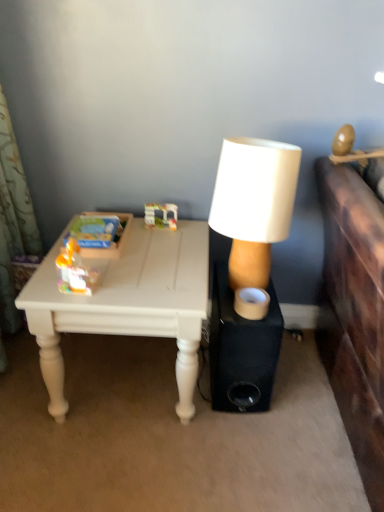
The height and width of the screenshot is (512, 384). I want to click on vacant region to the right of matte plastic toy at left, marked as the 2th toy in a top-to-bottom arrangement, so click(131, 284).